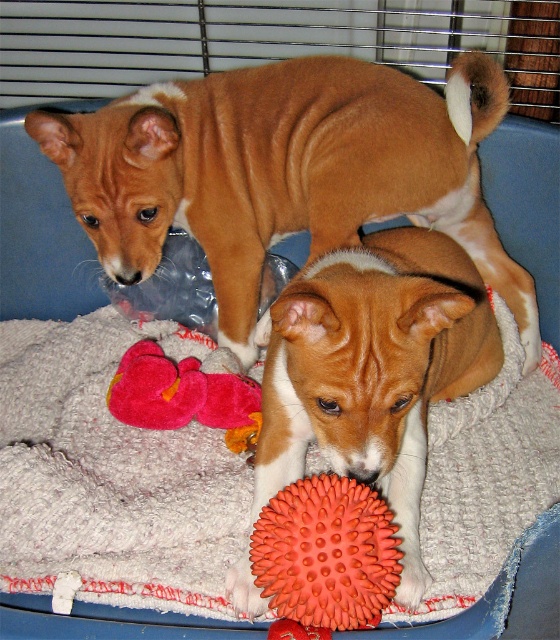
You are a photographer trying to capture a closeup of the orange spiky ball. You notice two points in the scene labeled as point (x=491, y=308) and point (x=231, y=364). Which point should you focus on to ensure the ball is in focus?

Point (x=491, y=308) is further to the camera than point (x=231, y=364). Since the orange spiky ball is the subject, you should focus on point (x=491, y=308) to ensure the ball is in focus as it is closer to the camera.

You are a dog trainer who wants to ensure the two puppies in the image are safe. The orange spiky ball is placed at point (336, 304). Given that the puppies are 1.04 meters apart, can you confirm if the ball is within a 1.5 meter safety radius from both puppies?

The puppies are 1.04 meters apart, so the orange spiky ball at point (336, 304) is within a 1.5 meter safety radius from both puppies because the distance between them is less than 1.5 meters.

You are a dog owner who wants to ensure the safety of your pets. You notice the brown smooth dog at upper center and the brown matte dog at center. Which dog is located above the other?

The brown smooth dog at upper center is positioned over the brown matte dog at center, so the brown smooth dog at upper center is above the brown matte dog at center.